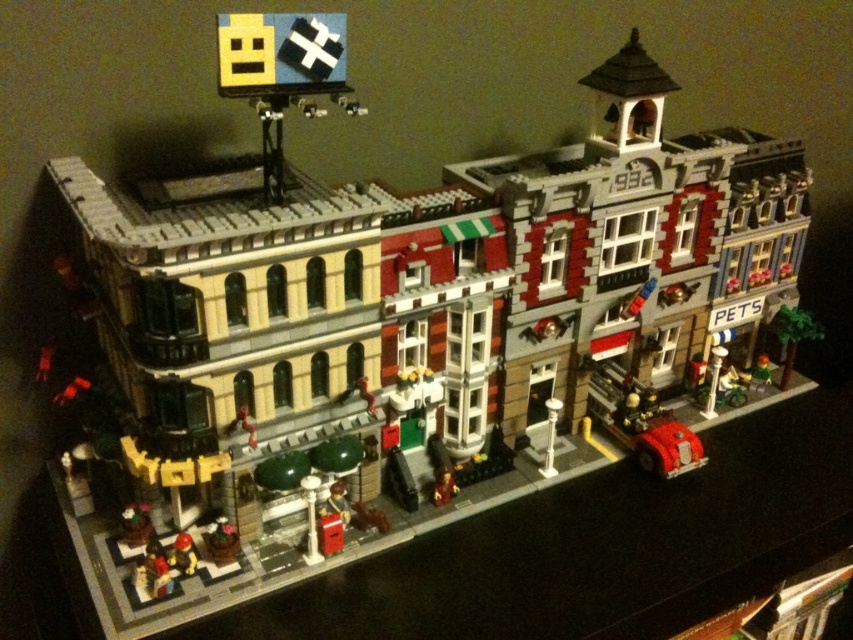
You are standing in front of a LEGO model of a multi story building. You want to place a new LEGO figure at point (x=177, y=564). If the figure is 1.5 feet tall, will it be visible from your current position?

The point (x=177, y=564) is 3.61 feet away from the viewer. Since the figure is 1.5 feet tall, it will be visible as the distance is greater than the height, allowing it to be seen without obstruction.